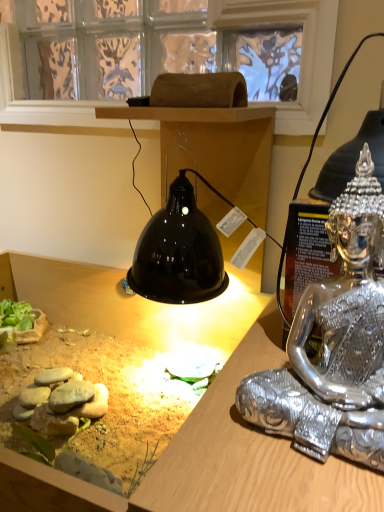
Question: Is matte black lamp at upper center far away from transparent glass window screen at upper center?

Choices:
 (A) no
 (B) yes

Answer: (A)

Question: From the image's perspective, is matte black lamp at upper center on transparent glass window screen at upper center?

Choices:
 (A) yes
 (B) no

Answer: (B)

Question: Is matte black lamp at upper center located outside transparent glass window screen at upper center?

Choices:
 (A) yes
 (B) no

Answer: (A)

Question: From a real-world perspective, is matte black lamp at upper center positioned under transparent glass window screen at upper center based on gravity?

Choices:
 (A) yes
 (B) no

Answer: (A)

Question: Is matte black lamp at upper center shorter than transparent glass window screen at upper center?

Choices:
 (A) yes
 (B) no

Answer: (A)

Question: Does matte black lamp at upper center have a greater width compared to transparent glass window screen at upper center?

Choices:
 (A) yes
 (B) no

Answer: (A)

Question: Would you say transparent glass window screen at upper center contains silver metallic statue at right?

Choices:
 (A) no
 (B) yes

Answer: (A)

Question: From a real-world perspective, is transparent glass window screen at upper center positioned over silver metallic statue at right based on gravity?

Choices:
 (A) yes
 (B) no

Answer: (A)

Question: Could you tell me if transparent glass window screen at upper center is facing silver metallic statue at right?

Choices:
 (A) no
 (B) yes

Answer: (A)

Question: Considering the relative sizes of transparent glass window screen at upper center and silver metallic statue at right in the image provided, is transparent glass window screen at upper center smaller than silver metallic statue at right?

Choices:
 (A) yes
 (B) no

Answer: (B)

Question: Does transparent glass window screen at upper center have a larger size compared to silver metallic statue at right?

Choices:
 (A) no
 (B) yes

Answer: (B)

Question: Is transparent glass window screen at upper center to the right of silver metallic statue at right from the viewer's perspective?

Choices:
 (A) no
 (B) yes

Answer: (A)

Question: Is matte black lamp at upper center not within silver metallic statue at right?

Choices:
 (A) yes
 (B) no

Answer: (A)